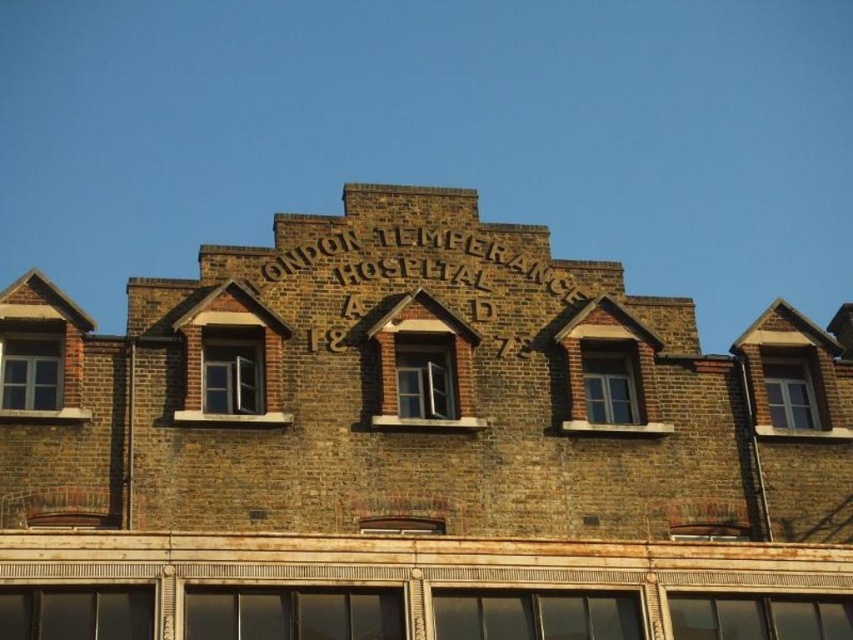
Question: Does matte glass window at lower left have a larger size compared to matte brown window at left?

Choices:
 (A) yes
 (B) no

Answer: (B)

Question: Among these objects, which one is farthest from the camera?

Choices:
 (A) matte brown window at left
 (B) clear glass window at center
 (C) matte glass window at center
 (D) matte brick window at center-left

Answer: (B)

Question: Which object is farther from the camera taking this photo?

Choices:
 (A) dark glass window at lower center
 (B) clear glass window at center
 (C) dark glass window at center
 (D) matte glass window at lower left

Answer: (B)

Question: In this image, where is matte brick window at center-left located relative to matte gray window at upper right?

Choices:
 (A) left
 (B) right

Answer: (A)

Question: Does dark glass window at center appear on the right side of clear glass window at center?

Choices:
 (A) yes
 (B) no

Answer: (B)

Question: Which of the following is the farthest from the observer?

Choices:
 (A) matte glass window at lower left
 (B) dark glass window at center

Answer: (B)